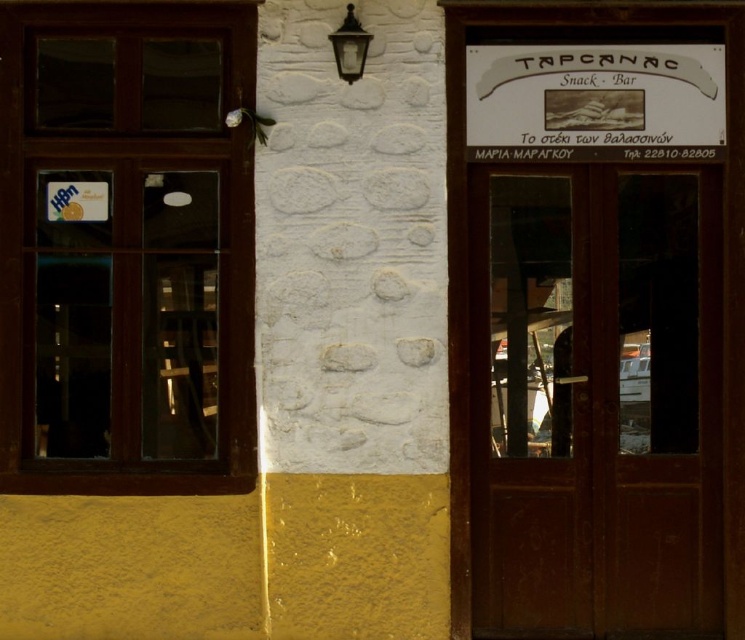
Is brown wooden window at left smaller than brown wooden door at right?

No, brown wooden window at left is not smaller than brown wooden door at right.

Locate an element on the screen. This screenshot has height=640, width=745. brown wooden window at left is located at coordinates (126, 250).

I want to click on brown wooden window at left, so (x=126, y=250).

At what (x,y) coordinates should I click in order to perform the action: click on brown wooden window at left. Please return your answer as a coordinate pair (x, y). Image resolution: width=745 pixels, height=640 pixels. Looking at the image, I should click on (126, 250).

Describe the element at coordinates (126, 250) in the screenshot. This screenshot has width=745, height=640. I see `brown wooden window at left` at that location.

Can you confirm if brown wooden window at left is thinner than white paper sign at upper center?

Correct, brown wooden window at left's width is less than white paper sign at upper center's.

Is point (60, 316) farther from viewer compared to point (653, 84)?

Yes.

Image resolution: width=745 pixels, height=640 pixels. I want to click on brown wooden window at left, so click(x=126, y=250).

Where is `brown wooden door at right`? This screenshot has height=640, width=745. brown wooden door at right is located at coordinates (596, 401).

Can you confirm if brown wooden door at right is positioned above white paper sign at upper center?

No, brown wooden door at right is not above white paper sign at upper center.

Describe the element at coordinates (596, 401) in the screenshot. I see `brown wooden door at right` at that location.

The height and width of the screenshot is (640, 745). In order to click on brown wooden door at right in this screenshot , I will do `click(596, 401)`.